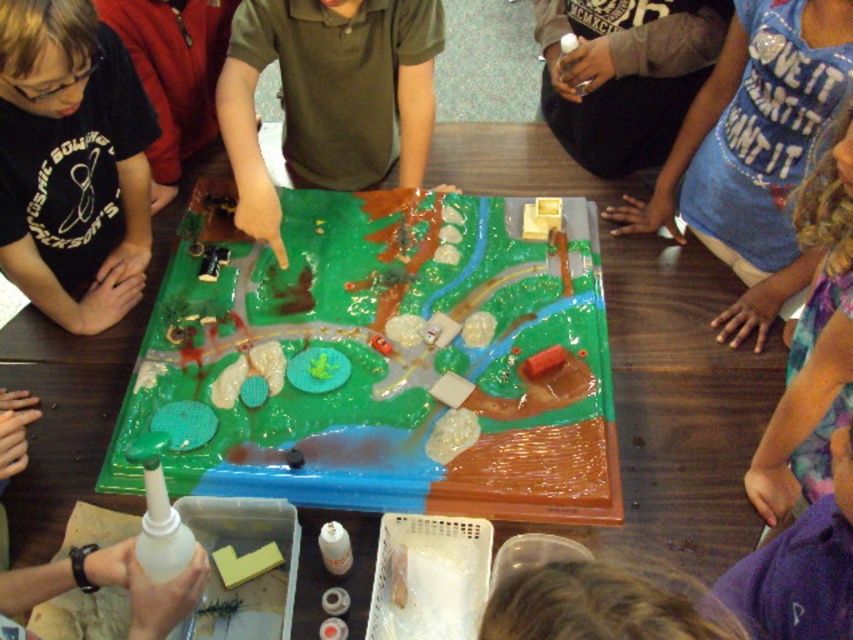
Question: From the image, what is the correct spatial relationship of green matte board game at center in relation to black matte shirt at upper left?

Choices:
 (A) above
 (B) below

Answer: (B)

Question: Is black matte shirt at upper left thinner than purple tie-dye shirt at upper right?

Choices:
 (A) yes
 (B) no

Answer: (B)

Question: Which object appears farthest from the camera in this image?

Choices:
 (A) black matte shirt at upper left
 (B) green matte board game at center
 (C) purple tie-dye shirt at upper right

Answer: (B)

Question: Does black matte shirt at upper left come in front of purple tie-dye shirt at upper right?

Choices:
 (A) no
 (B) yes

Answer: (A)

Question: Which object appears farthest from the camera in this image?

Choices:
 (A) green matte board game at center
 (B) black matte shirt at upper left
 (C) purple tie-dye shirt at upper right

Answer: (A)

Question: Among these points, which one is nearest to the camera?

Choices:
 (A) (122, 314)
 (B) (485, 209)
 (C) (822, 209)

Answer: (C)